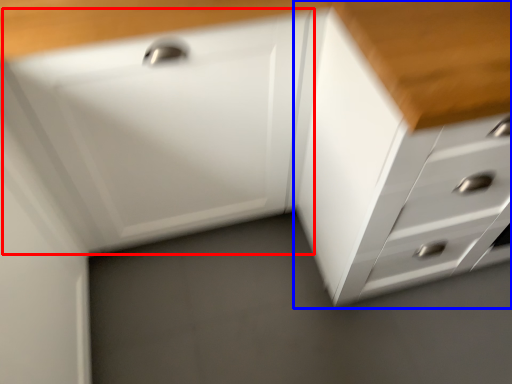
Question: Among these objects, which one is nearest to the camera, drawer (highlighted by a red box) or chest of drawers (highlighted by a blue box)?

Choices:
 (A) drawer
 (B) chest of drawers

Answer: (B)